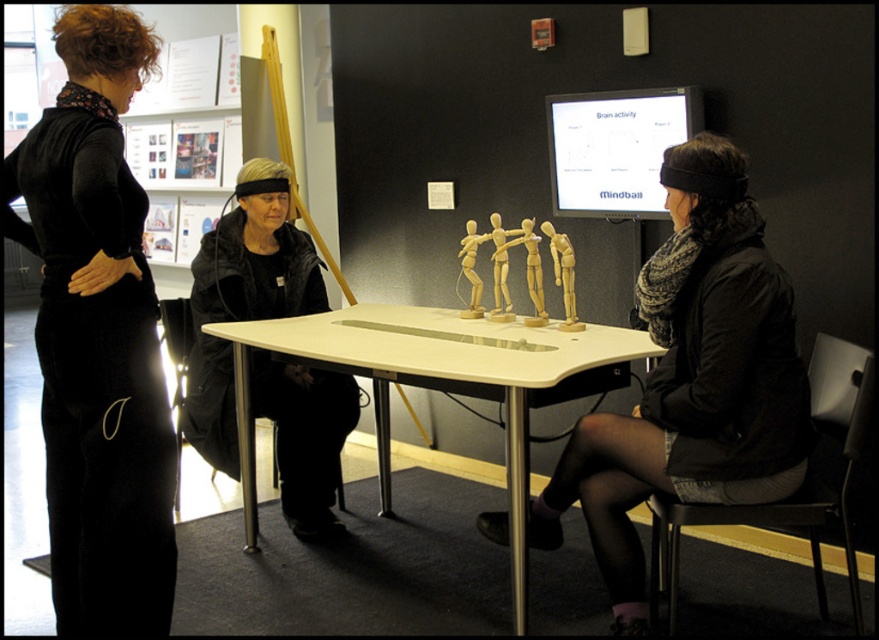
Question: Is the position of wooden mannequin at center more distant than that of white glossy table at center?

Choices:
 (A) yes
 (B) no

Answer: (B)

Question: Is black fabric dress at left to the right of white glossy table at center from the viewer's perspective?

Choices:
 (A) yes
 (B) no

Answer: (B)

Question: Is black fabric dress at left bigger than wooden mannequin at center?

Choices:
 (A) no
 (B) yes

Answer: (A)

Question: Based on their relative distances, which object is farther from the wooden mannequin at center?

Choices:
 (A) black fabric dress at left
 (B) white glossy table at center

Answer: (A)

Question: Which object is the farthest from the white glossy table at center?

Choices:
 (A) wooden mannequin at center
 (B) black fabric dress at left

Answer: (B)

Question: Among these points, which one is farthest from the camera?

Choices:
 (A) (594, 445)
 (B) (318, 289)

Answer: (B)